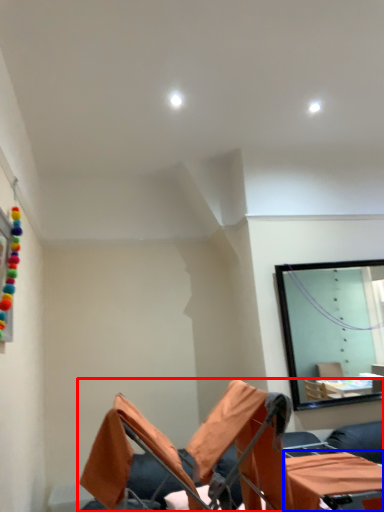
Question: Which object is further to the camera taking this photo, furniture (highlighted by a red box) or table (highlighted by a blue box)?

Choices:
 (A) furniture
 (B) table

Answer: (B)